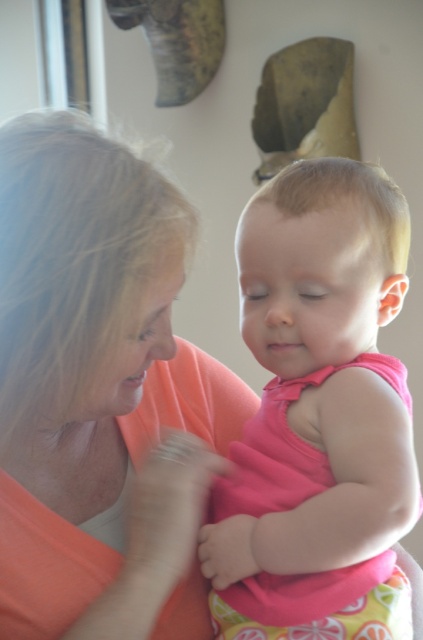
Between point (147, 440) and point (280, 266), which one is positioned in front?

Point (280, 266)

Between matte orange shirt at center and pink fabric toddler at center, which one appears on the right side from the viewer's perspective?

Positioned to the right is pink fabric toddler at center.

Who is more distant from viewer, (71, 355) or (272, 513)?

Positioned behind is point (272, 513).

Locate an element on the screen. This screenshot has width=423, height=640. matte orange shirt at center is located at coordinates (99, 392).